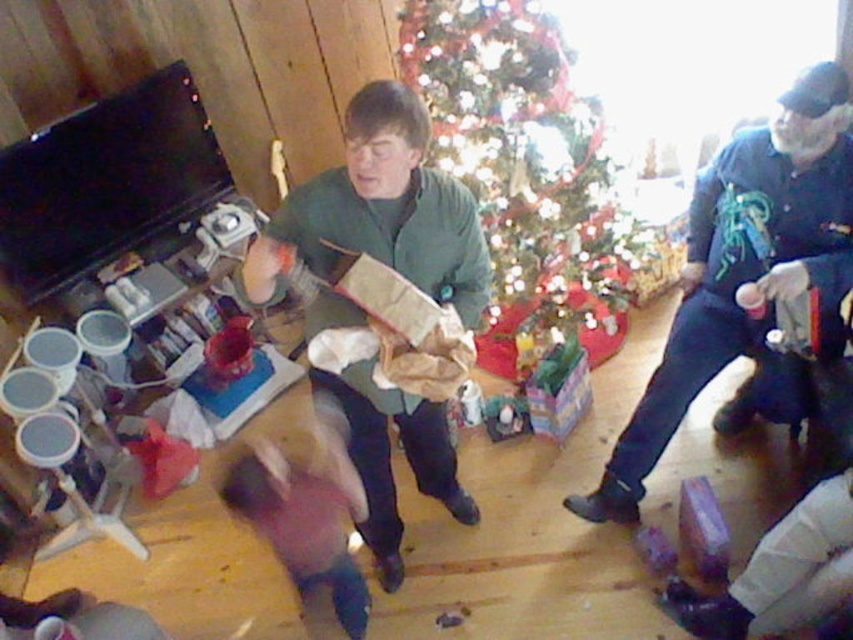
Question: Which object is the closest to the blue denim jacket at right?

Choices:
 (A) shiny green christmas tree at center
 (B) green matte jacket at center

Answer: (A)

Question: Can you confirm if shiny green christmas tree at center is positioned to the right of green matte jacket at center?

Choices:
 (A) yes
 (B) no

Answer: (A)

Question: Which point is closer to the camera taking this photo?

Choices:
 (A) (727, 332)
 (B) (549, 90)

Answer: (A)

Question: Is shiny green christmas tree at center wider than blue denim jacket at right?

Choices:
 (A) no
 (B) yes

Answer: (B)

Question: Is shiny green christmas tree at center thinner than blue denim jacket at right?

Choices:
 (A) yes
 (B) no

Answer: (B)

Question: Which point is farther to the camera?

Choices:
 (A) (477, 260)
 (B) (808, 228)
 (C) (544, 77)

Answer: (C)